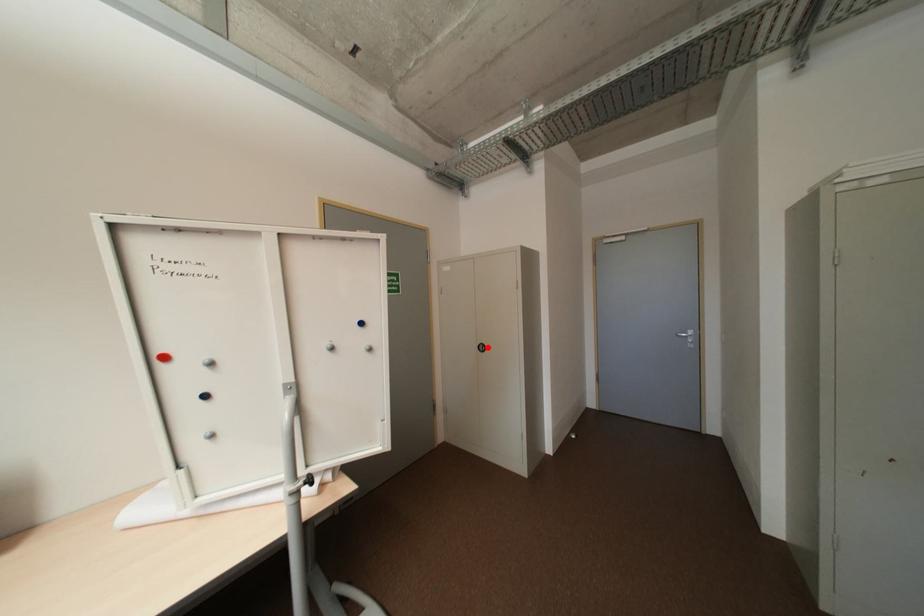
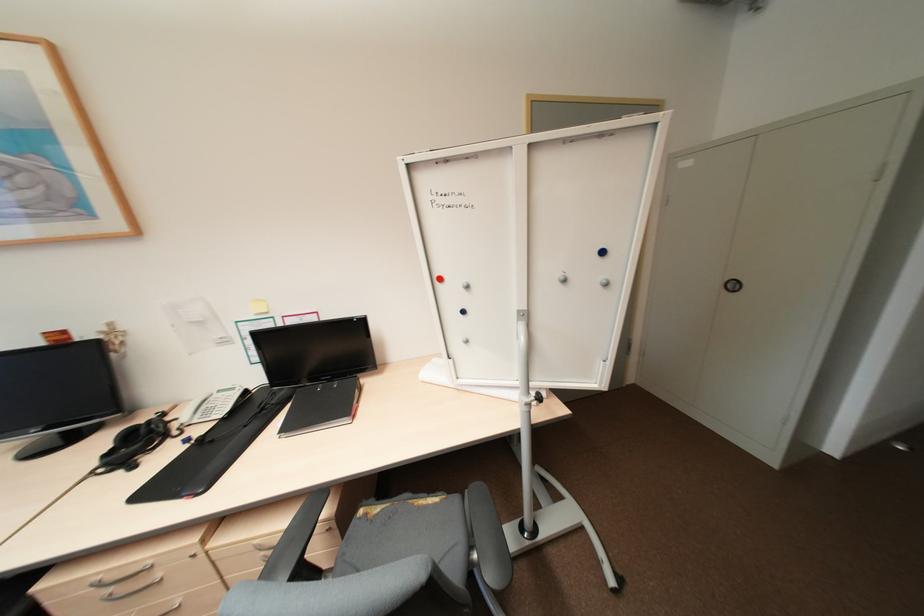
In the second image, find the point that corresponds to the highlighted location in the first image.

(738, 286)